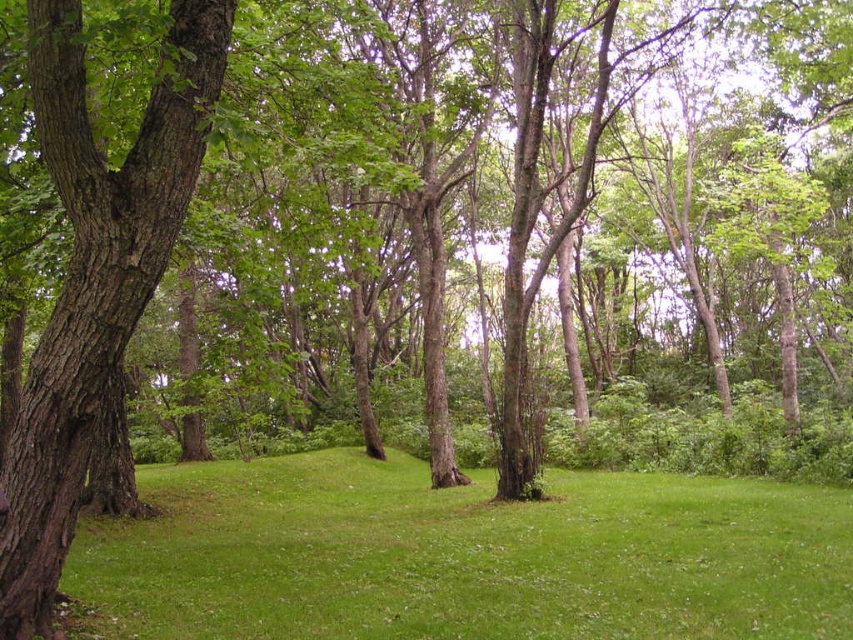
Who is more distant from viewer, (74,566) or (96,358)?

Point (74,566)

Is point (132, 544) more distant than point (45, 355)?

Yes.

At what (x,y) coordinates should I click in order to perform the action: click on green grassy at center. Please return your answer as a coordinate pair (x, y). This screenshot has width=853, height=640. Looking at the image, I should click on (466, 556).